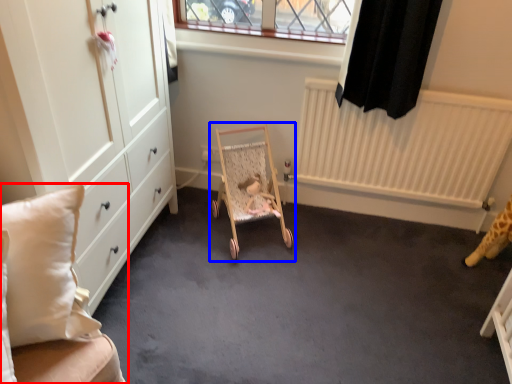
Question: Which object is further to the camera taking this photo, furniture (highlighted by a red box) or baby carriage (highlighted by a blue box)?

Choices:
 (A) furniture
 (B) baby carriage

Answer: (B)